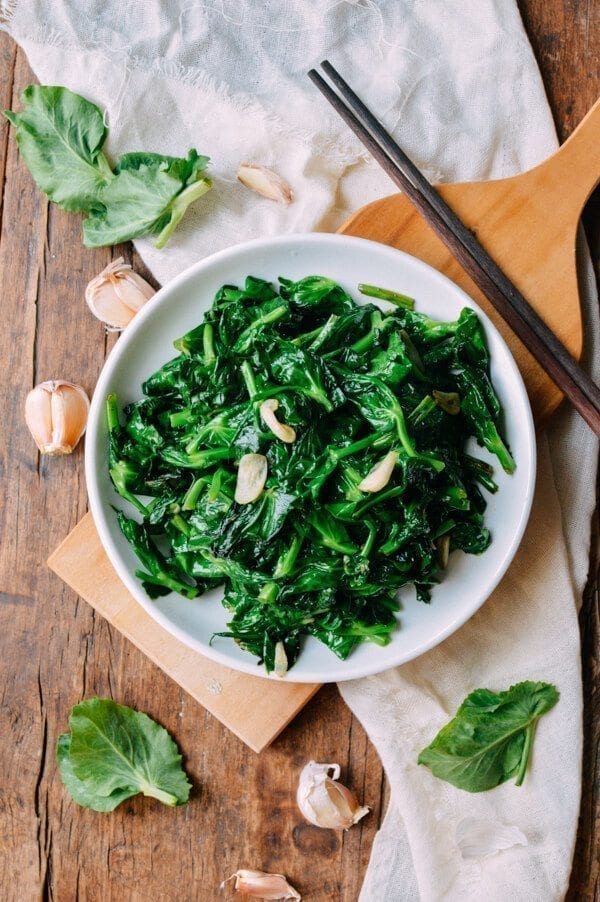
Image resolution: width=600 pixels, height=902 pixels. Find the location of `cutting board`. cutting board is located at coordinates (230, 706), (506, 229).